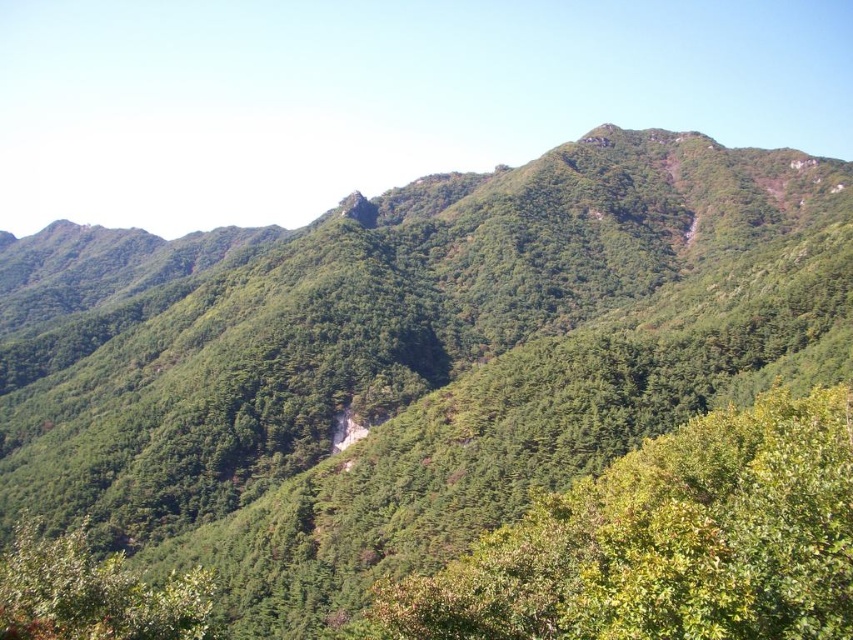
You are a hiker standing at the base of the green leafy tree at center and the green matte tree at lower left. Which tree would you need to walk towards first to reach the summit of the mountain?

The green leafy tree at center is closer to the viewer than the green matte tree at lower left, so you should walk towards the green matte tree at lower left first to reach the summit since it is further away.

You are standing at the origin point of this mountain landscape. You want to reach the green leafy tree at center. Which direction should you move in to get there?

The green leafy tree at center is located at coordinates point (664, 541), so you should move towards the right and forward to reach it.